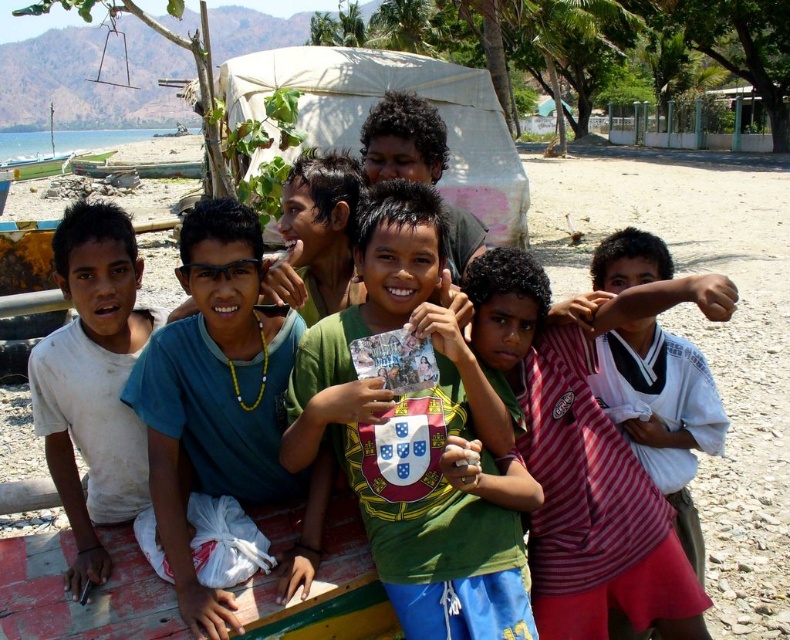
Question: Which is nearer to the green jersey at center?

Choices:
 (A) blue fabric shirt at center
 (B) white plastic boat at left

Answer: (A)

Question: Which of the following is the farthest from the observer?

Choices:
 (A) (205, 205)
 (B) (615, 472)
 (C) (17, 177)

Answer: (C)

Question: Can you confirm if blue fabric shirt at center is bigger than white plastic boat at left?

Choices:
 (A) yes
 (B) no

Answer: (B)

Question: Is green jersey at center thinner than blue fabric shirt at center?

Choices:
 (A) no
 (B) yes

Answer: (A)

Question: Can you confirm if striped fabric shirt at center is positioned to the right of blue fabric shirt at center?

Choices:
 (A) yes
 (B) no

Answer: (A)

Question: Which point appears closest to the camera in this image?

Choices:
 (A) (59, 164)
 (B) (108, 244)

Answer: (B)